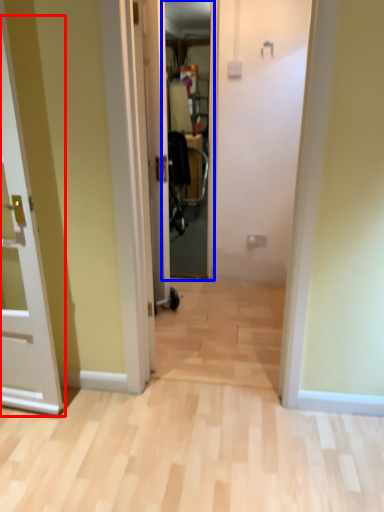
Question: Which object is closer to the camera taking this photo, door (highlighted by a red box) or screen door (highlighted by a blue box)?

Choices:
 (A) door
 (B) screen door

Answer: (A)